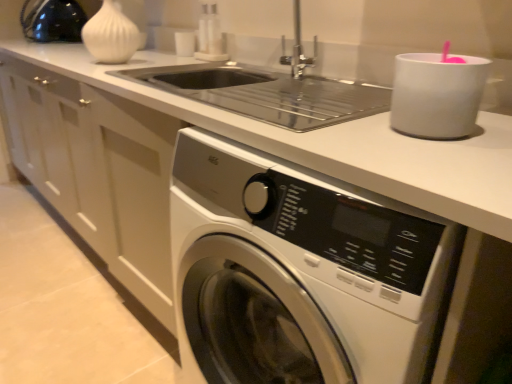
Image resolution: width=512 pixels, height=384 pixels. Find the location of `spots to the right of white matte vase at upper left`. spots to the right of white matte vase at upper left is located at coordinates (167, 59).